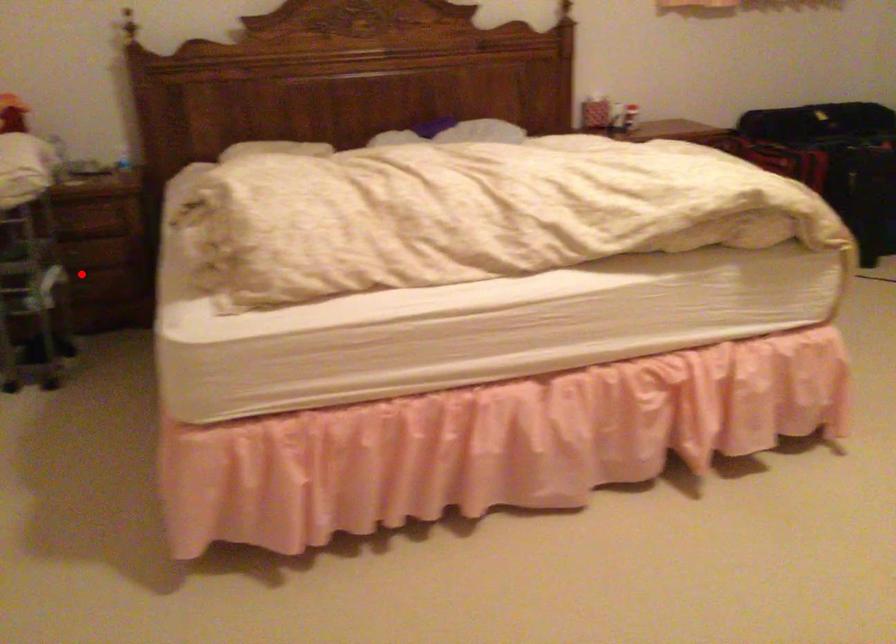
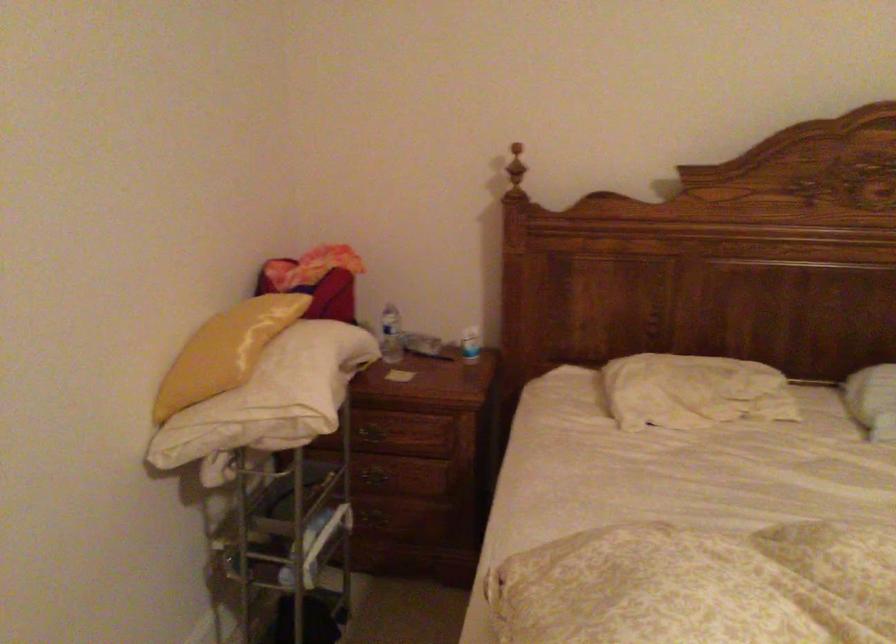
Question: I am providing you with two images of the same scene from different viewpoints. In image1, a red point is highlighted. Considering the same 3D point in image2, which of the following is correct?

Choices:
 (A) It is closer
 (B) It is farther

Answer: (A)